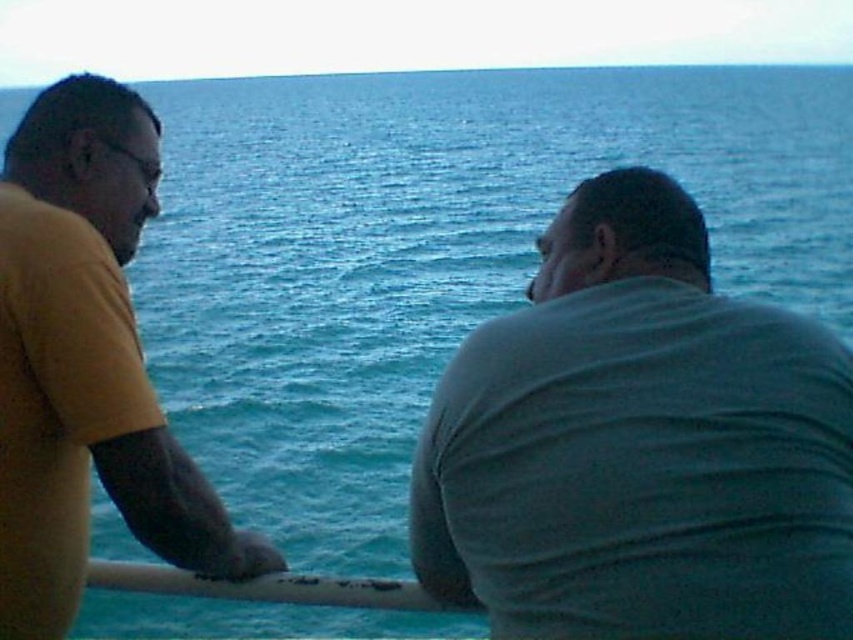
Question: Which object is closer to the camera taking this photo?

Choices:
 (A) matte yellow t-shirt at left
 (B) white matte rail at center

Answer: (A)

Question: Estimate the real-world distances between objects in this image. Which object is farther from the matte yellow t-shirt at left?

Choices:
 (A) gray matte shirt at right
 (B) white matte rail at center

Answer: (A)

Question: Which point is farther to the camera?

Choices:
 (A) gray matte shirt at right
 (B) matte yellow t-shirt at left
 (C) white matte rail at center

Answer: (C)

Question: Considering the relative positions of gray matte shirt at right and white matte rail at center in the image provided, where is gray matte shirt at right located with respect to white matte rail at center?

Choices:
 (A) above
 (B) below

Answer: (A)

Question: Is matte yellow t-shirt at left wider than white matte rail at center?

Choices:
 (A) yes
 (B) no

Answer: (B)

Question: Is matte yellow t-shirt at left bigger than white matte rail at center?

Choices:
 (A) yes
 (B) no

Answer: (A)